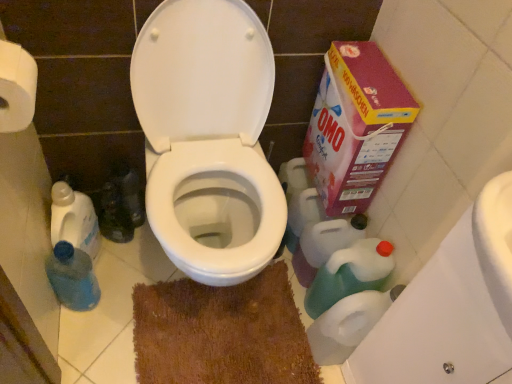
Find the location of `vacant area located to the right-hand side of translucent plastic bottle at lower left, the 1th cleaning product in the left-to-right sequence`. vacant area located to the right-hand side of translucent plastic bottle at lower left, the 1th cleaning product in the left-to-right sequence is located at coordinates (129, 273).